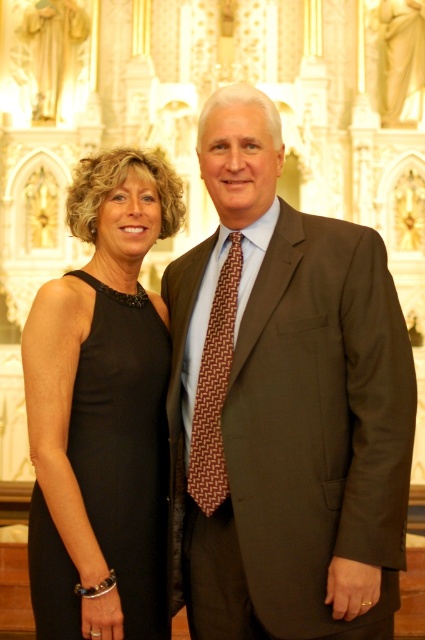
You are a photographer standing 5 meters away from the two subjects in the church. You need to capture a closeup shot of both the brown textured suit at center and the brown woven tie at center in a single frame without moving your camera. Is it possible given their distance apart?

The brown textured suit at center and brown woven tie at center are 3.19 meters apart from each other. Since the photographer is 5 meters away, the maximum distance they can capture in the frame would depend on the camera lens. However, 3.19 meters between the two objects is less than the 5 meter distance, so it is likely possible to capture both in a single frame without moving the camera.

You are standing in a church and want to take a photo of the brown textured suit at center. The camera you are using has a focus point at coordinate point (283, 404). Will the focus point be on the brown textured suit at center?

Yes, the brown textured suit at center is located at point (283, 404), so the focus point will be on it.